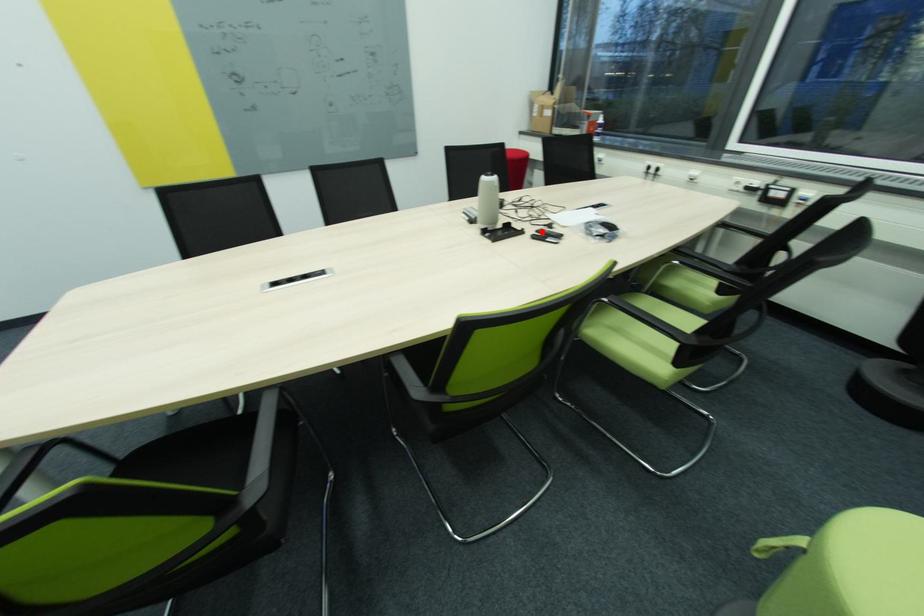
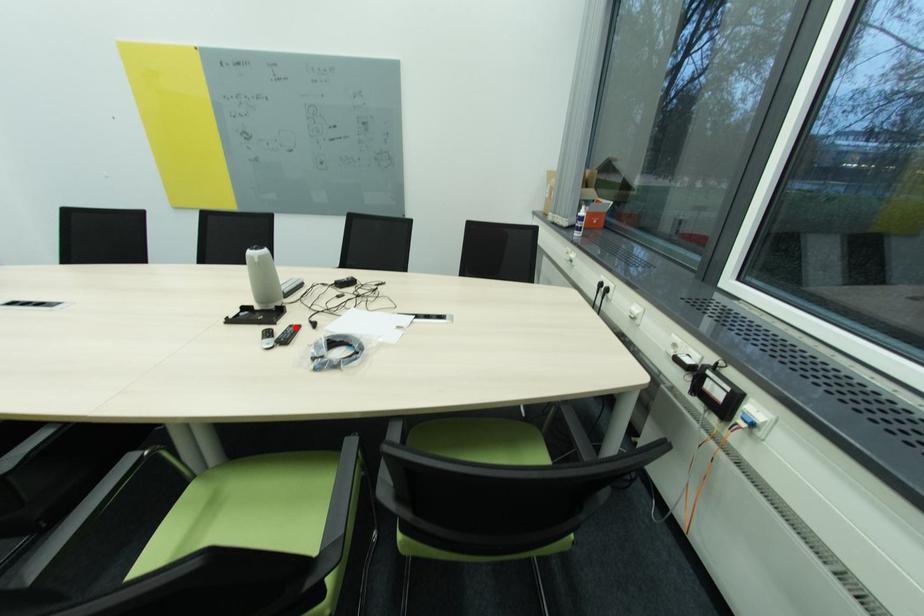
I am providing you with two images of the same scene from different viewpoints. A red point is marked on the first image and another point is marked on the second image. Does the point marked in image1 correspond to the same location as the one in image2?

Yes